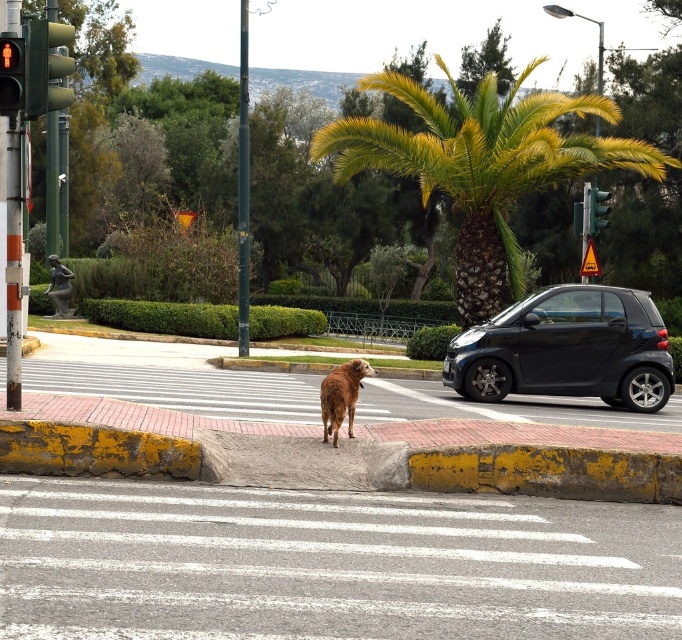
You are a pedestrian waiting at the sidewalk. You see the green matte traffic light at upper left and the red matte pedestrian signal at left. Which one is located to the right of the other?

The green matte traffic light at upper left is positioned on the right side of the red matte pedestrian signal at left.

You are a pedestrian waiting at the crosswalk and see the green matte traffic light at upper left and the green glass traffic light at upper right. Which traffic light is smaller in size?

The green matte traffic light at upper left is smaller in size compared to the green glass traffic light at upper right.

You are a pedestrian standing on the sidewalk near the curb where the small, reddish brown dog is located. You want to cross the street at the pedestrian crossing. The traffic light for pedestrians is located at the green matte traffic light at upper left. Is the traffic light for pedestrians currently showing a red signal?

The traffic light for pedestrians is showing a red signal, so you should not cross the street until it turns green.